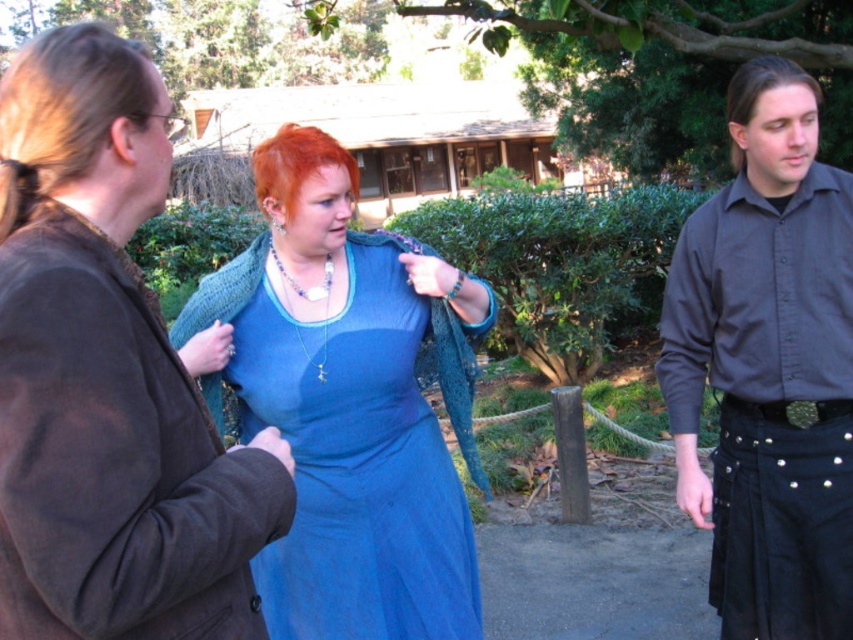
You are standing in the scene and want to place a small flowerpot between the two points, point [109,115] and point [276,182]. Which point should the flowerpot be closer to in order to be closer to the camera?

The flowerpot should be closer to point [109,115] because it is closer to the camera than point [276,182].

You are a fashion designer observing the scene. You notice the matte black shirt at center and the green metallic belt at lower right. Which clothing item is positioned higher on the person?

The matte black shirt at center is located above the green metallic belt at lower right, so the matte black shirt at center is positioned higher.